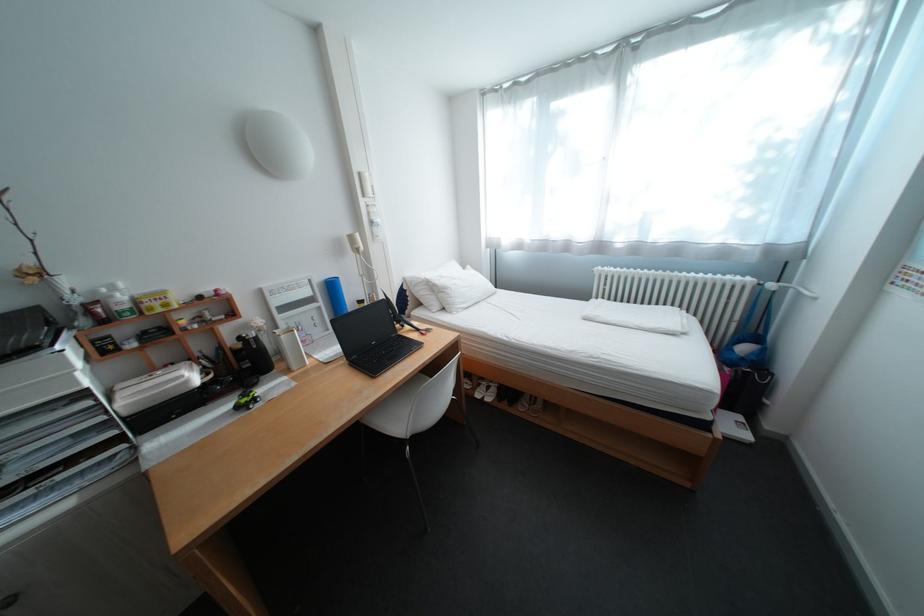
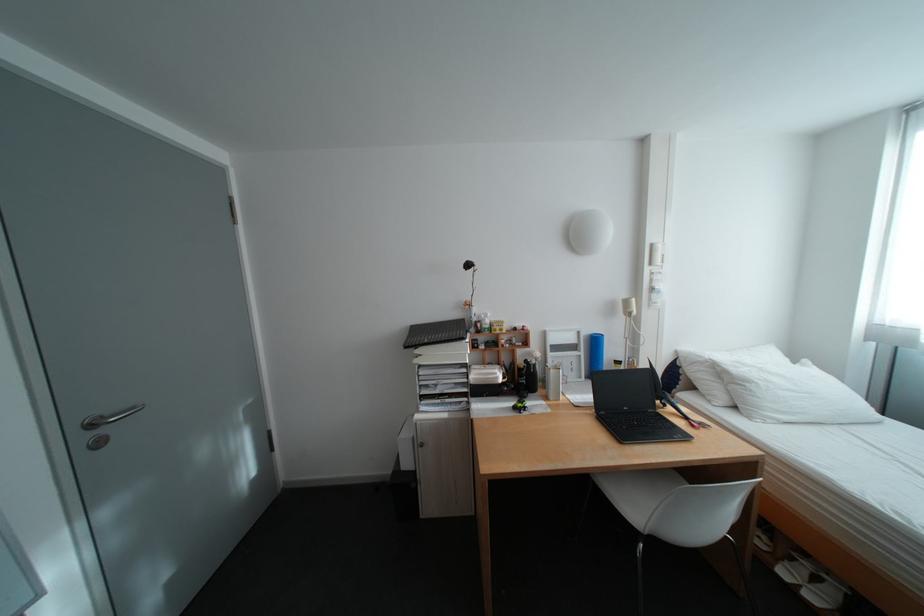
The point at (496, 398) is marked in the first image. Where is the corresponding point in the second image?

(813, 586)